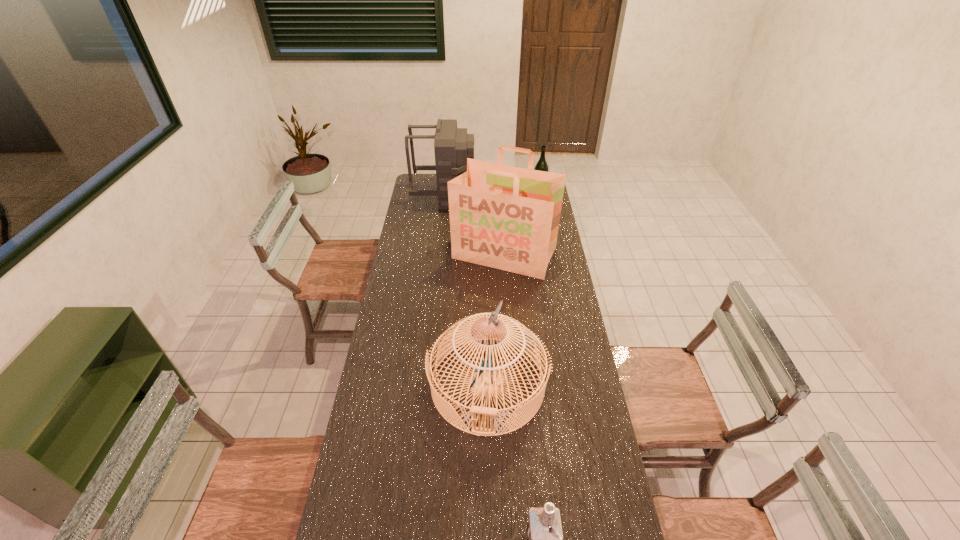
Identify the location of wine bottle located at the far edge. (541, 165).

Locate an element on the screen. Image resolution: width=960 pixels, height=540 pixels. object that is at the left edge is located at coordinates (452, 146).

This screenshot has width=960, height=540. Find the location of `grocery bag that is at the right edge`. grocery bag that is at the right edge is located at coordinates (504, 217).

Where is `birdcage located in the right edge section of the desktop`? birdcage located in the right edge section of the desktop is located at coordinates (488, 383).

Find the location of a particular element. wine bottle that is at the right edge is located at coordinates (541, 165).

At what (x,y) coordinates should I click in order to perform the action: click on object positioned at the far left corner. Please return your answer as a coordinate pair (x, y). This screenshot has height=540, width=960. Looking at the image, I should click on (452, 146).

You are a GUI agent. You are given a task and a screenshot of the screen. Output one action in this format:
    pyautogui.click(x=<x>, y=<y>)
    Task: Click on the object positioned at the far right corner
    The image size is (960, 540).
    Given the screenshot: What is the action you would take?
    pyautogui.click(x=541, y=165)

The image size is (960, 540). Find the location of `vacant region at the left edge of the desktop`. vacant region at the left edge of the desktop is located at coordinates (431, 230).

Locate an element on the screen. The image size is (960, 540). free space at the right edge is located at coordinates (577, 345).

In the image, there is a desktop. Where is `vacant area at the far left corner`? vacant area at the far left corner is located at coordinates (436, 177).